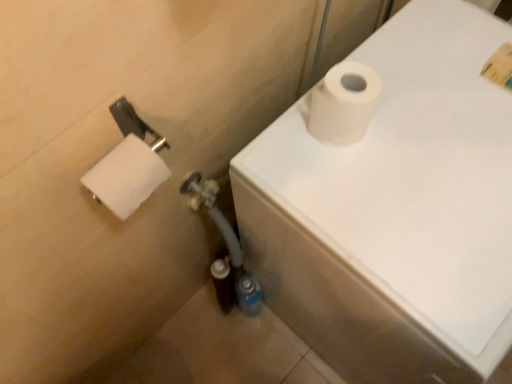
Locate an element on the screen. The height and width of the screenshot is (384, 512). empty space that is ontop of white matte toilet paper at upper right is located at coordinates (437, 160).